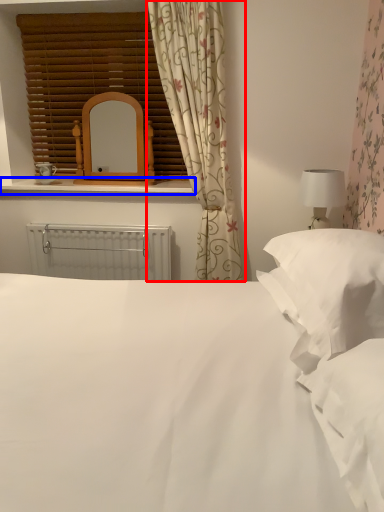
Question: Which object is closer to the camera taking this photo, curtain (highlighted by a red box) or window sill (highlighted by a blue box)?

Choices:
 (A) curtain
 (B) window sill

Answer: (A)